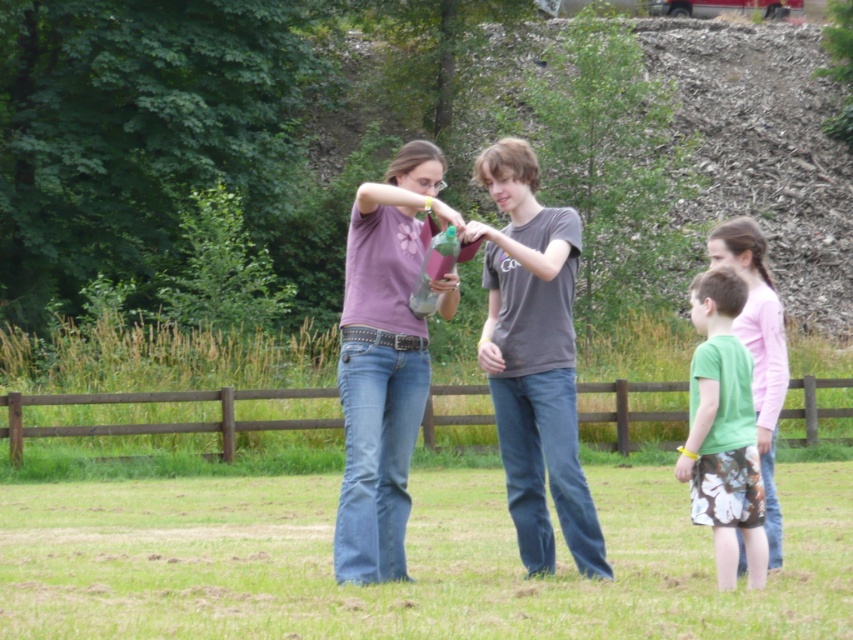
Question: Observing the image, what is the correct spatial positioning of gray cotton shirt at center in reference to pink fabric shirt at right?

Choices:
 (A) right
 (B) left

Answer: (B)

Question: Which point is closer to the camera?

Choices:
 (A) pink fabric shirt at right
 (B) gray cotton shirt at center

Answer: (B)

Question: Which point is farther to the camera?

Choices:
 (A) pink fabric shirt at right
 (B) matte purple shirt at center
 (C) translucent plastic bottle at center
 (D) green fabric shorts at lower right

Answer: (B)

Question: Can you confirm if matte purple shirt at center is wider than pink fabric shirt at right?

Choices:
 (A) yes
 (B) no

Answer: (B)

Question: Can you confirm if matte purple shirt at center is smaller than translucent plastic bottle at center?

Choices:
 (A) yes
 (B) no

Answer: (A)

Question: Which object is farther from the camera taking this photo?

Choices:
 (A) matte purple shirt at center
 (B) green fabric shorts at lower right
 (C) translucent plastic bottle at center
 (D) pink fabric shirt at right

Answer: (A)